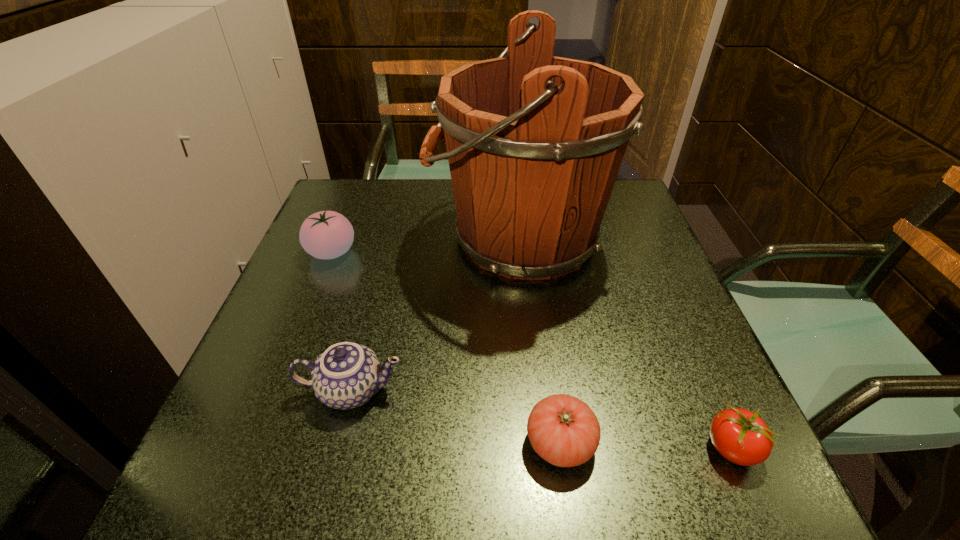
I want to click on free location that satisfies the following two spatial constraints: 1. with the handle on the side of the second tomato from left to right; 2. on the right side of the tallest object, so click(x=540, y=442).

Image resolution: width=960 pixels, height=540 pixels. Find the location of `vacant space that satisfies the following two spatial constraints: 1. from the spout of the rightmost tomato; 2. on the right side of the chinaware`. vacant space that satisfies the following two spatial constraints: 1. from the spout of the rightmost tomato; 2. on the right side of the chinaware is located at coordinates (337, 449).

Locate an element on the screen. Image resolution: width=960 pixels, height=540 pixels. free space that satisfies the following two spatial constraints: 1. with the handle on the side of the tallest object; 2. on the left side of the rightmost tomato is located at coordinates (540, 449).